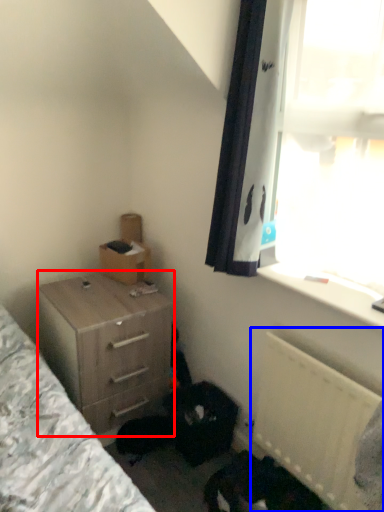
Question: Among these objects, which one is nearest to the camera, chest of drawers (highlighted by a red box) or radiator (highlighted by a blue box)?

Choices:
 (A) chest of drawers
 (B) radiator

Answer: (B)